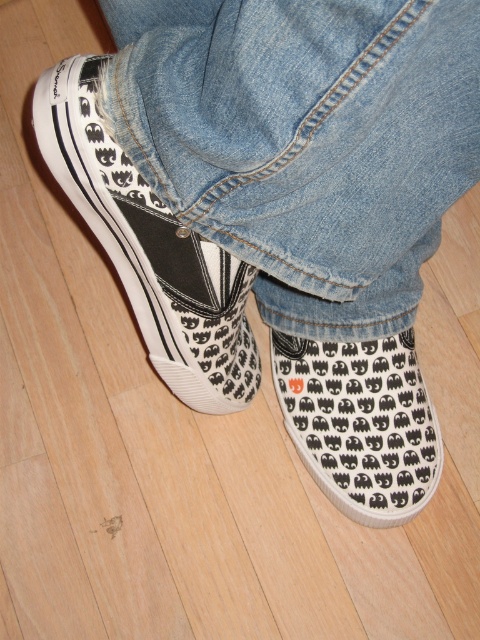
Looking at this image, you are standing in the scene and want to place a small sticker exactly at the point specified in the objects. Which object is located at point (151, 250)?

The canvas sneakers at lower left is located at point (151, 250).

You are a delivery robot with a height of 36 inches. You need to navigate through a space where there is a point at coordinates point (220, 275). Can you safely pass under this point without hitting your head?

The distance of point (220, 275) from viewer is 38.04 inches. Since the robot is 36 inches tall, it can safely pass under this point as the height clearance is sufficient.